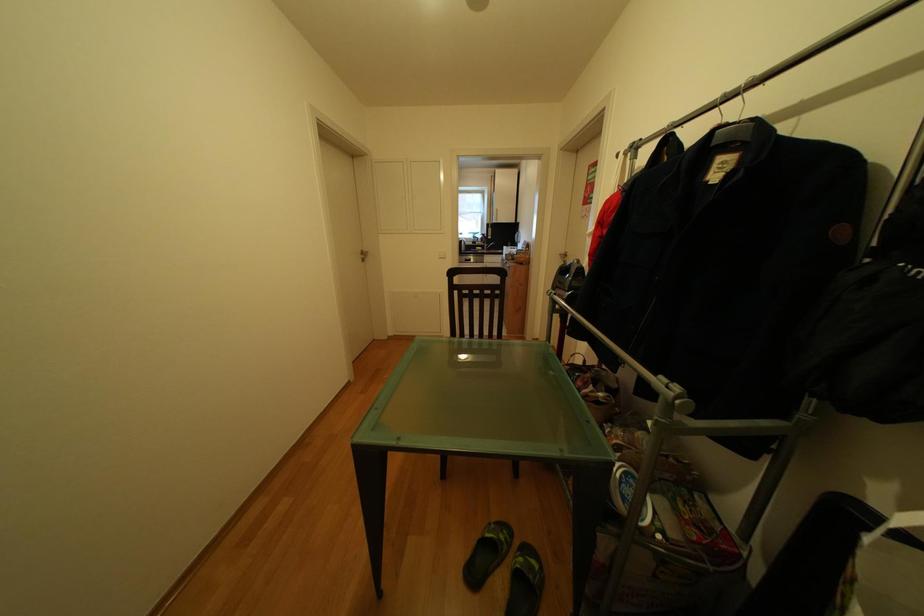
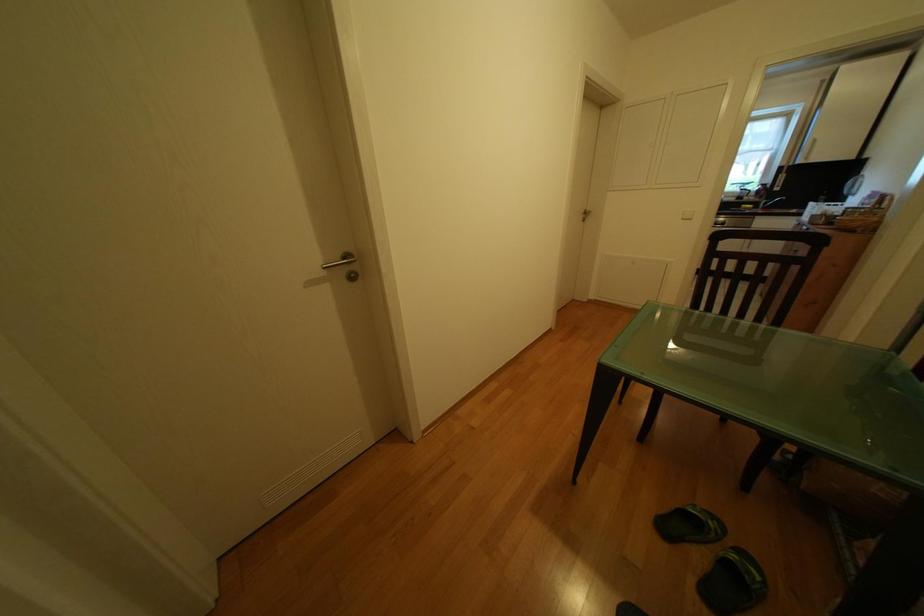
Question: The camera is either moving clockwise (left) or counter-clockwise (right) around the object. The first image is from the beginning of the video and the second image is from the end. Is the camera moving left or right when shooting the video?

Choices:
 (A) Left
 (B) Right

Answer: (B)